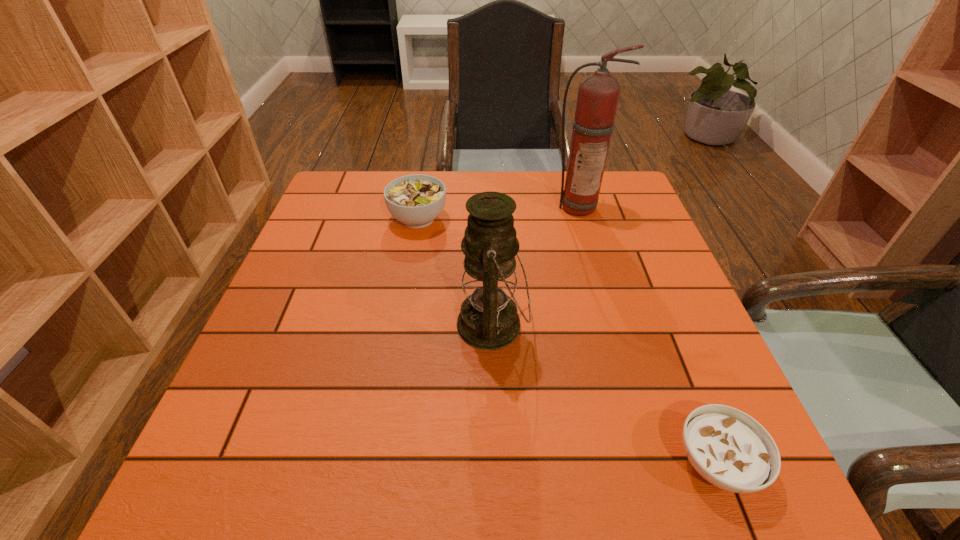
At what (x,y) coordinates should I click in order to perform the action: click on fire extinguisher. Please return your answer as a coordinate pair (x, y). The image size is (960, 540). Looking at the image, I should click on (598, 95).

What are the coordinates of `the third object from right to left` in the screenshot? It's located at (488, 319).

The height and width of the screenshot is (540, 960). In order to click on the third farthest object in this screenshot , I will do `click(488, 319)`.

Locate an element on the screen. The height and width of the screenshot is (540, 960). the leftmost object is located at coordinates (416, 200).

I want to click on the left soup bowl, so [x=416, y=200].

This screenshot has height=540, width=960. Find the location of `the right soup bowl`. the right soup bowl is located at coordinates pos(727,447).

The height and width of the screenshot is (540, 960). In order to click on the nearer soup bowl in this screenshot , I will do `click(727, 447)`.

The image size is (960, 540). What are the coordinates of `vacant space located on the side of the tallest object with the label and nozzle` in the screenshot? It's located at (588, 241).

The width and height of the screenshot is (960, 540). Find the location of `free spot located on the left of the second nearest object`. free spot located on the left of the second nearest object is located at coordinates (339, 325).

I want to click on free region located 0.350m on the right of the farther soup bowl, so click(574, 219).